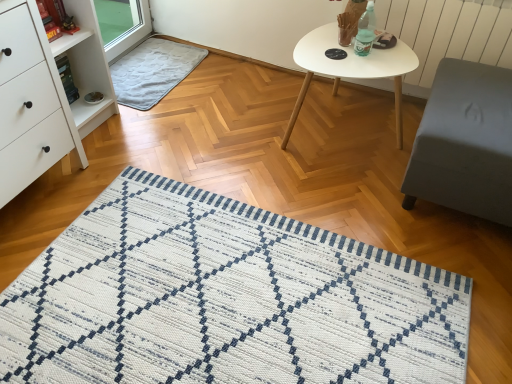
The height and width of the screenshot is (384, 512). Find the location of `vacant area that lies in front of white matte oval table at upper center`. vacant area that lies in front of white matte oval table at upper center is located at coordinates (329, 197).